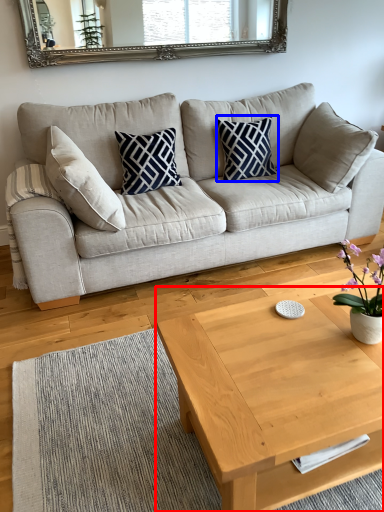
Question: Among these objects, which one is nearest to the camera, coffee table (highlighted by a red box) or pillow (highlighted by a blue box)?

Choices:
 (A) coffee table
 (B) pillow

Answer: (A)